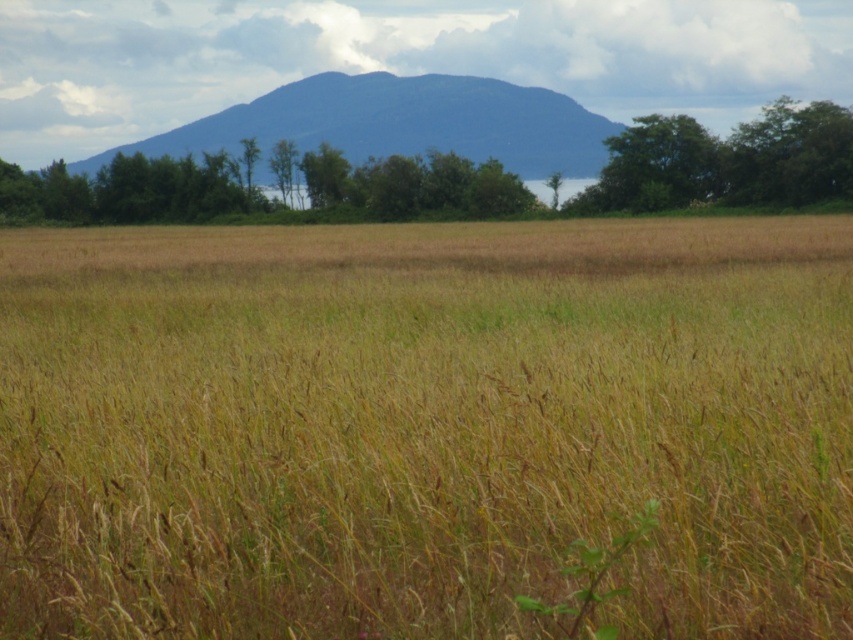
Image resolution: width=853 pixels, height=640 pixels. I want to click on brown grass at center, so click(x=424, y=428).

Which is in front, point (265, 444) or point (352, 84)?

Positioned in front is point (265, 444).

What are the coordinates of `brown grass at center` in the screenshot? It's located at (424, 428).

Does blue-green textured mountain at upper center appear over green leafy tree at upper right?

Yes, blue-green textured mountain at upper center is above green leafy tree at upper right.

Which is behind, point (474, 147) or point (766, 154)?

The point (474, 147) is behind.

This screenshot has width=853, height=640. In order to click on blue-green textured mountain at upper center in this screenshot , I will do `click(399, 124)`.

Which is in front, point (260, 424) or point (683, 150)?

Positioned in front is point (260, 424).

Does point (54, 360) lie behind point (700, 163)?

No, (54, 360) is closer to viewer.

Image resolution: width=853 pixels, height=640 pixels. In order to click on brown grass at center in this screenshot , I will do `click(424, 428)`.